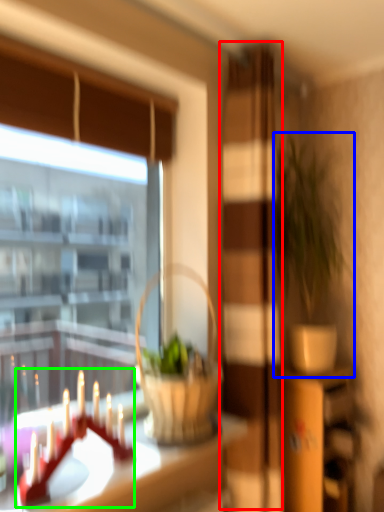
Question: Considering the real-world distances, which object is farthest from screen door (highlighted by a red box)? houseplant (highlighted by a blue box) or candle holder (highlighted by a green box)?

Choices:
 (A) houseplant
 (B) candle holder

Answer: (B)